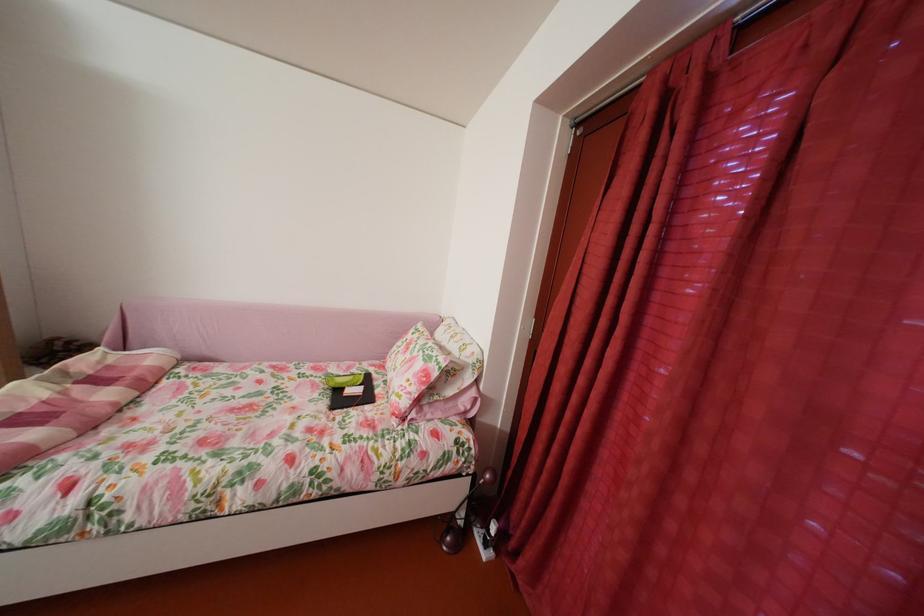
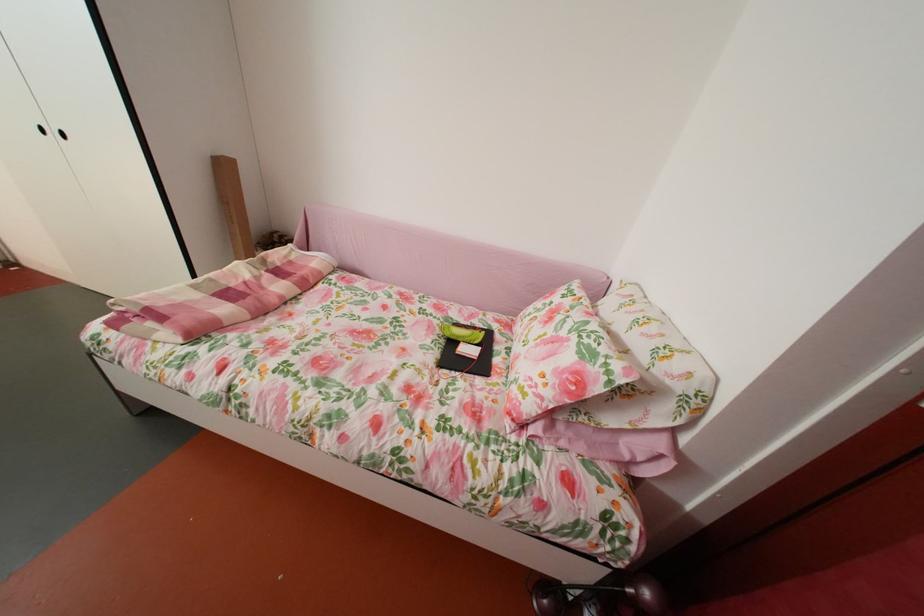
Consider the image. Based on the continuous images, in which direction is the camera rotating?

The rotation direction of the camera is left-down.